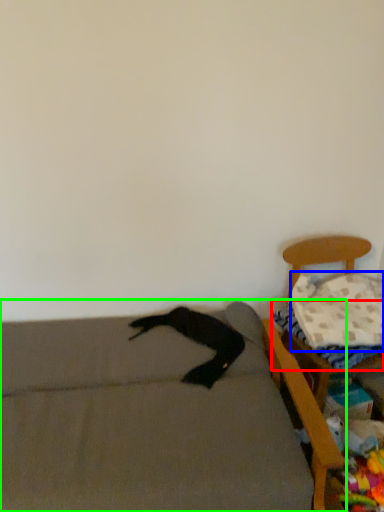
Question: Considering the real-world distances, which object is farthest from sheet (highlighted by a red box)? pillow (highlighted by a blue box) or furniture (highlighted by a green box)?

Choices:
 (A) pillow
 (B) furniture

Answer: (B)